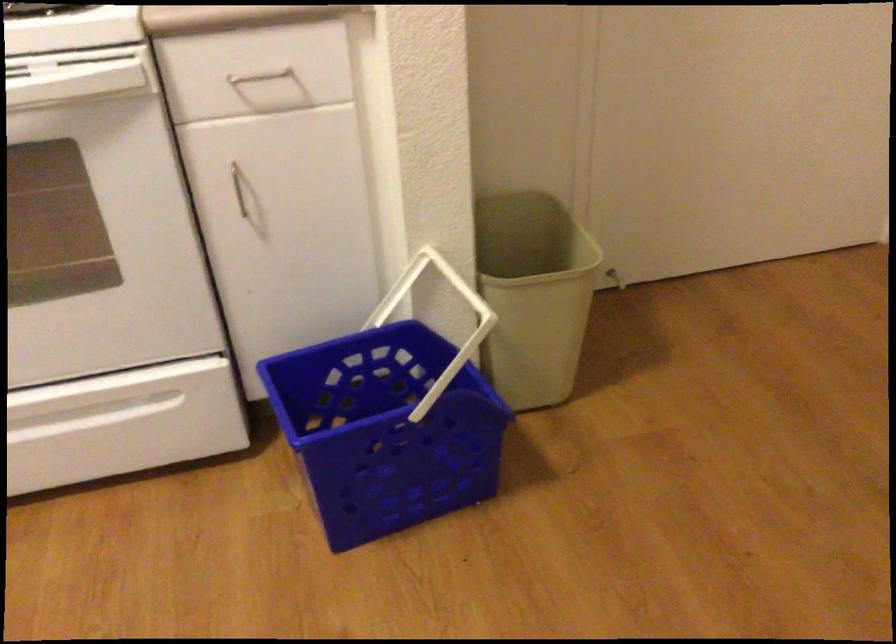
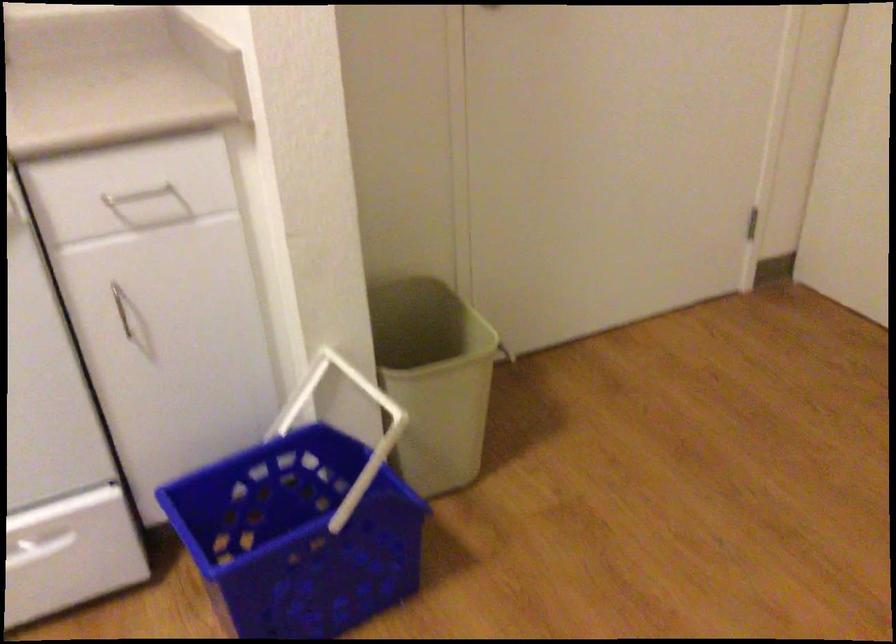
Find the pixel in the second image that matches the point at 263,78 in the first image.

(138, 194)